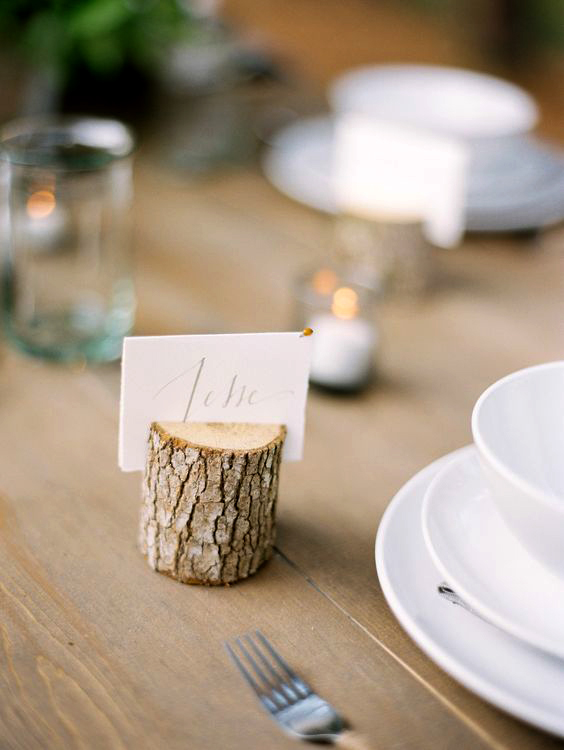
The width and height of the screenshot is (564, 750). In order to click on wood surface in this screenshot , I will do `click(321, 625)`.